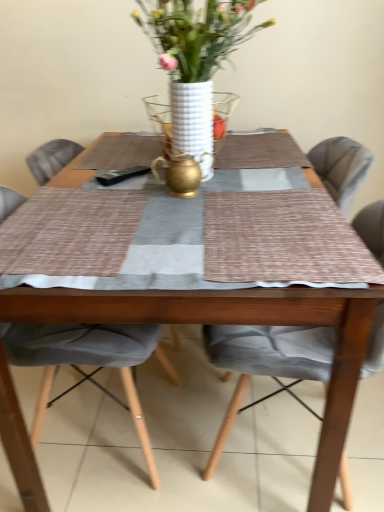
Identify the location of vacant area situated to the left side of white textured vase at center. This screenshot has width=384, height=512. (120, 157).